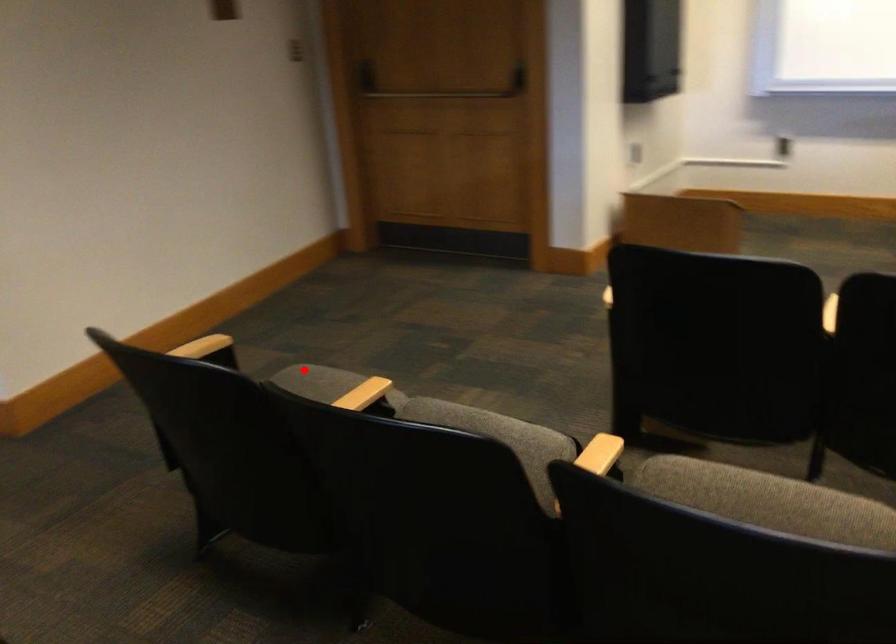
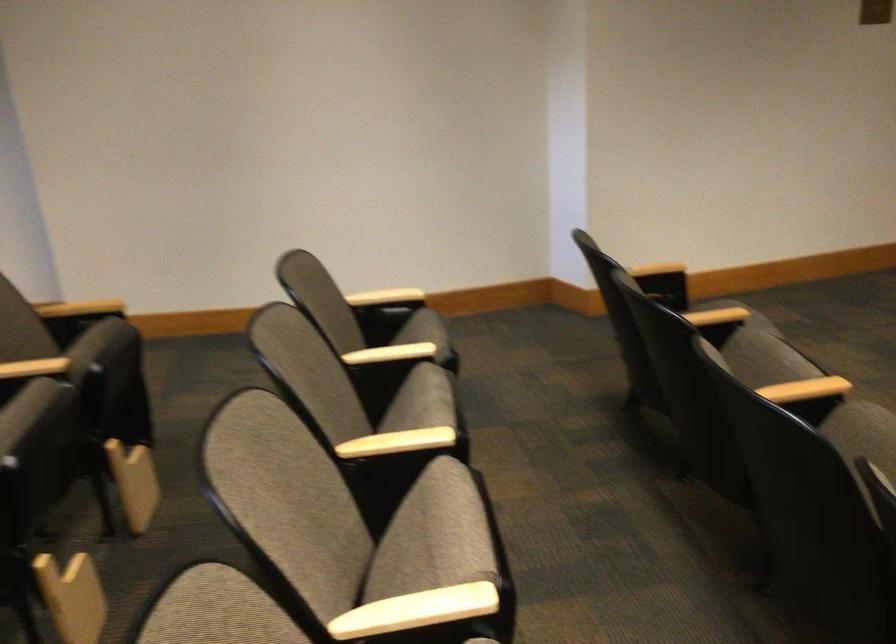
Question: I am providing you with two images of the same scene from different viewpoints. A red point is marked on the first image. At the location where the point appears in image 1, is it still visible in image 2?

Choices:
 (A) Yes
 (B) No

Answer: (B)